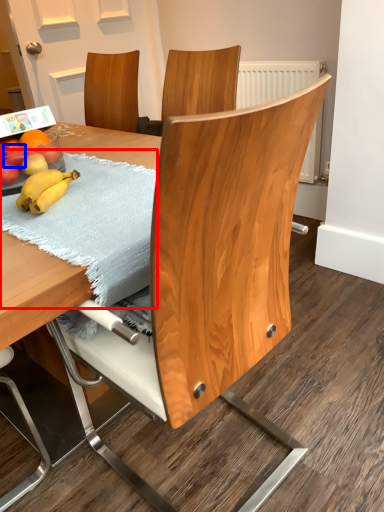
Question: Which point is further to the camera, blanket (highlighted by a red box) or apple (highlighted by a blue box)?

Choices:
 (A) blanket
 (B) apple

Answer: (B)